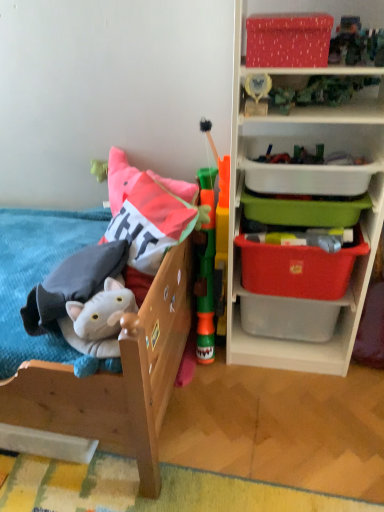
Question: Is plastic storage bins at right not near white plastic container at upper right, the fourth storage box positioned from the bottom?

Choices:
 (A) no
 (B) yes

Answer: (A)

Question: Is plastic storage bins at right surrounding white plastic container at upper right, the fourth storage box positioned from the bottom?

Choices:
 (A) no
 (B) yes

Answer: (B)

Question: Does plastic storage bins at right have a greater width compared to white plastic container at upper right, the fourth storage box positioned from the bottom?

Choices:
 (A) no
 (B) yes

Answer: (B)

Question: From the image's perspective, is plastic storage bins at right under white plastic container at upper right, which ranks as the 2th storage box in top-to-bottom order?

Choices:
 (A) no
 (B) yes

Answer: (B)

Question: Is white plastic container at upper right, which ranks as the 2th storage box in top-to-bottom order, at the back of plastic storage bins at right?

Choices:
 (A) no
 (B) yes

Answer: (B)

Question: Choose the correct answer: Is plastic storage bins at right inside green plastic tower at center, which ranks as the 2th toy in left-to-right order, or outside it?

Choices:
 (A) outside
 (B) inside

Answer: (A)

Question: Is plastic storage bins at right taller or shorter than green plastic tower at center, positioned as the 1th toy in right-to-left order?

Choices:
 (A) tall
 (B) short

Answer: (A)

Question: Is plastic storage bins at right bigger or smaller than green plastic tower at center, positioned as the 1th toy in right-to-left order?

Choices:
 (A) small
 (B) big

Answer: (B)

Question: From the image's perspective, relative to green plastic tower at center, positioned as the 1th toy in right-to-left order, is plastic storage bins at right above or below?

Choices:
 (A) above
 (B) below

Answer: (A)

Question: Considering the positions of plastic storage bins at right and red plastic storage box at right, which is counted as the second storage box, starting from the bottom, in the image, is plastic storage bins at right taller or shorter than red plastic storage box at right, which is counted as the second storage box, starting from the bottom,?

Choices:
 (A) tall
 (B) short

Answer: (A)

Question: Is point (274, 356) positioned closer to the camera than point (291, 267)?

Choices:
 (A) closer
 (B) farther

Answer: (B)

Question: From a real-world perspective, is plastic storage bins at right positioned above or below red plastic storage box at right, the fourth storage box in the top-to-bottom sequence?

Choices:
 (A) above
 (B) below

Answer: (A)

Question: Which is correct: plastic storage bins at right is inside red plastic storage box at right, which is counted as the second storage box, starting from the bottom, or outside of it?

Choices:
 (A) outside
 (B) inside

Answer: (A)

Question: Considering the positions of wooden bed at left and red plastic storage box at right, the fourth storage box in the top-to-bottom sequence, in the image, is wooden bed at left taller or shorter than red plastic storage box at right, the fourth storage box in the top-to-bottom sequence,?

Choices:
 (A) short
 (B) tall

Answer: (B)

Question: Is point (49, 402) positioned closer to the camera than point (269, 254)?

Choices:
 (A) farther
 (B) closer

Answer: (B)